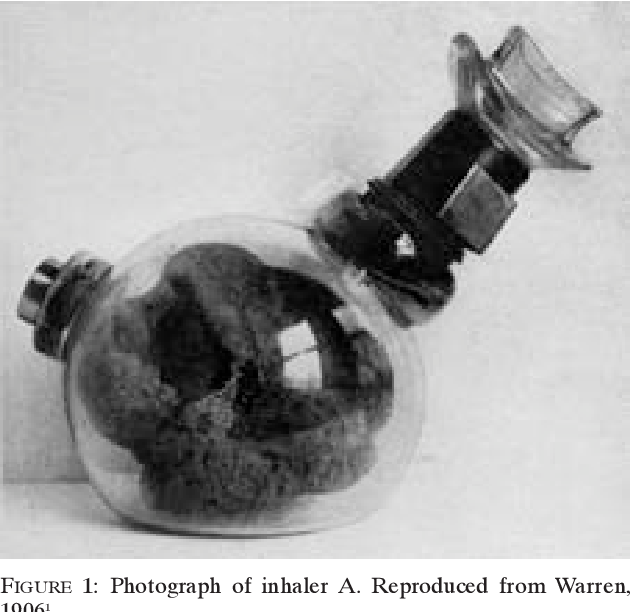
The width and height of the screenshot is (632, 612). In order to click on sponge in this screenshot , I will do `click(244, 379)`.